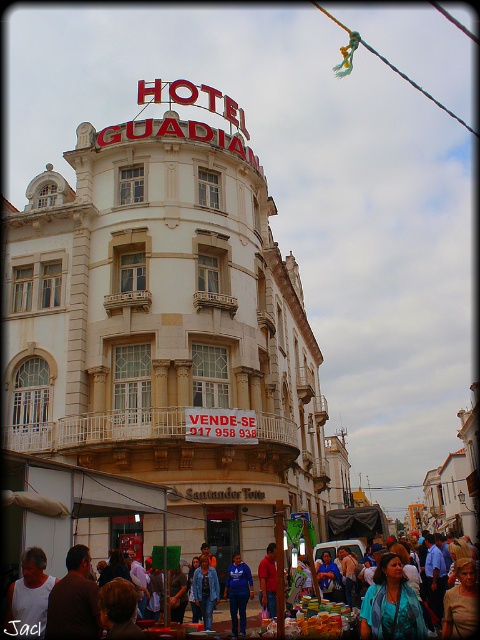
You are standing at the point labeled as point (21, 604) in the scene. If you want to take a photo of the entire Hotel Guardian building, would you need to move closer or farther away from the building to ensure the entire structure fits in the frame?

Since the point (21, 604) is 33.35 meters away from the camera, you would need to move closer to the building to ensure the entire Hotel Guardian structure fits in the frame. Being farther away might make the building appear smaller in the photo.

You are a delivery person standing at the entrance of the HOTEL GUARDIAN. You need to place a teal satin blouse at center and a denim jacket at center in a display window. The display window is 15 meters wide. Can both items fit side by side within the display window without overlapping?

The teal satin blouse at center and denim jacket at center are 13.37 meters apart. Since the display window is 15 meters wide, both items can fit side by side within the display window without overlapping as the total required space is less than the window width.

You are a customer in a clothing store and see the teal satin blouse at center and the white tank top at lower left. Which piece of clothing is closer to the bottom of the store display?

The white tank top at lower left is closer to the bottom of the store display because it is positioned above the teal satin blouse at center.